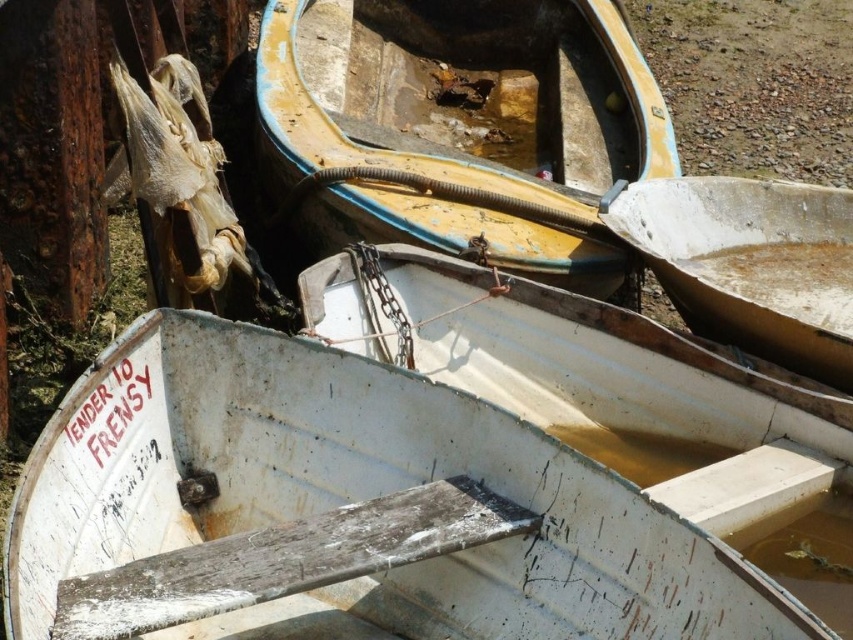
You are a maintenance worker who needs to move a 6 feet long ladder from the white weathered wood boat at center to the yellowish faded wood boat at center. Can you safely move the ladder without tilting it vertically? Please explain your reasoning based on the distance between the two boats.

The white weathered wood boat at center and yellowish faded wood boat at center are 5.74 feet apart. Since the ladder is 6 feet long, it is longer than the distance between the two boats. To move it horizontally, the ladder would need to be tilted at an angle where its length doesn not exceed the gap. However, since 6 feet is longer than 5.74 feet, tilting it would still cause part of the ladder to extend beyond the space between the boats. Therefore, it is not safe to move the ladder horizontally. Tilting

You are standing at the edge of the water body and see the white matte boat at center and the brown gravel at upper right. Which object is closer to your left side?

The white matte boat at center is to the left of brown gravel at upper right, so it is closer to your left side.